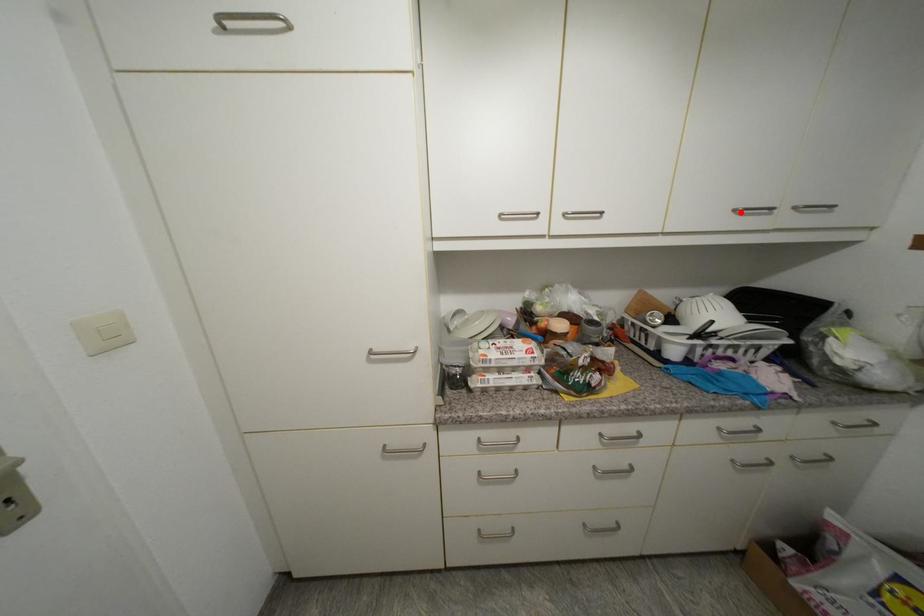
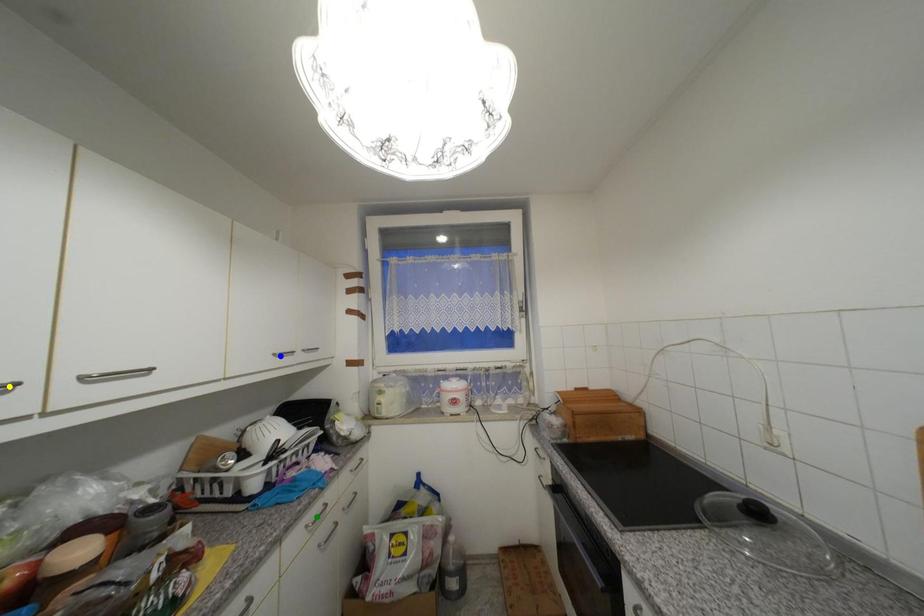
Question: I am providing you with two images of the same scene from different viewpoints. A red point is marked on the first image. You are given multiple points on the second image. Which point in image 2 represents the same 3d spot as the red point in image 1?

Choices:
 (A) green point
 (B) blue point
 (C) yellow point

Answer: (B)